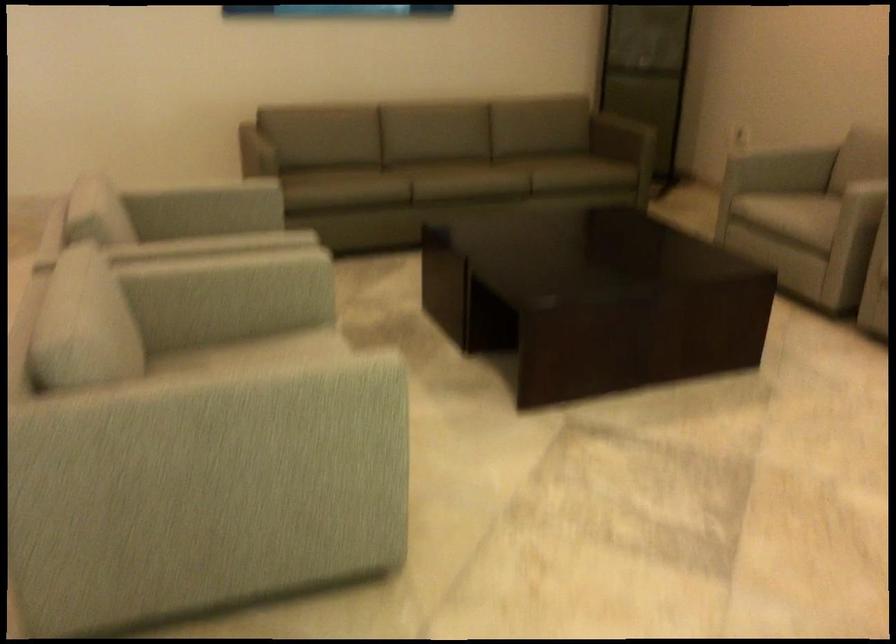
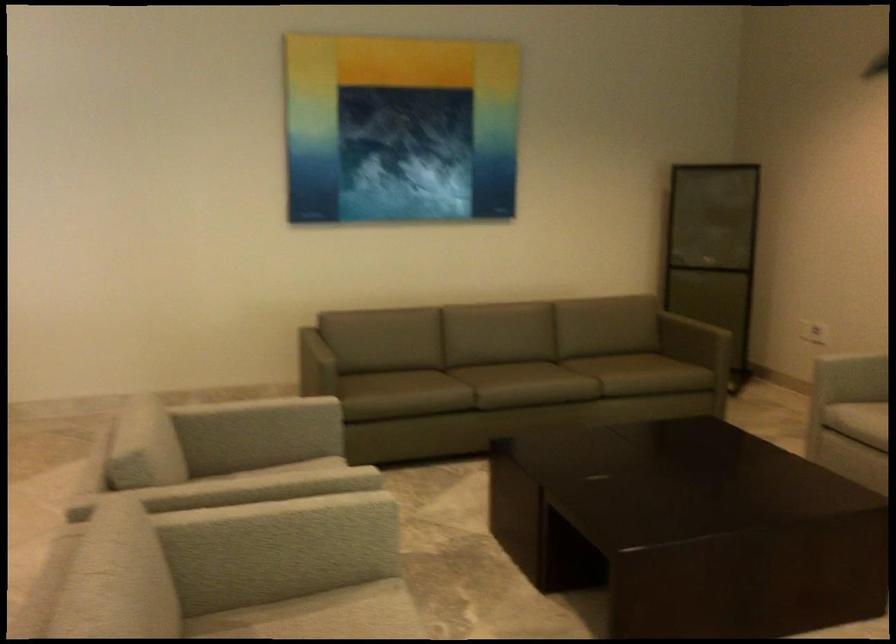
The point at (458, 178) is marked in the first image. Where is the corresponding point in the second image?

(524, 384)